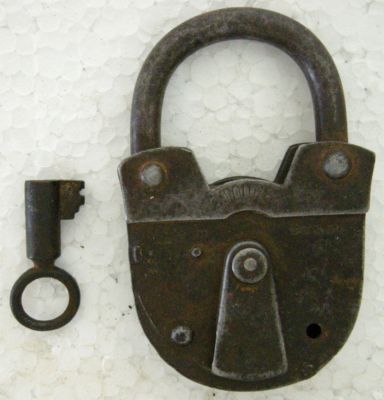
Find the location of a particular element. lock is located at coordinates (281, 234).